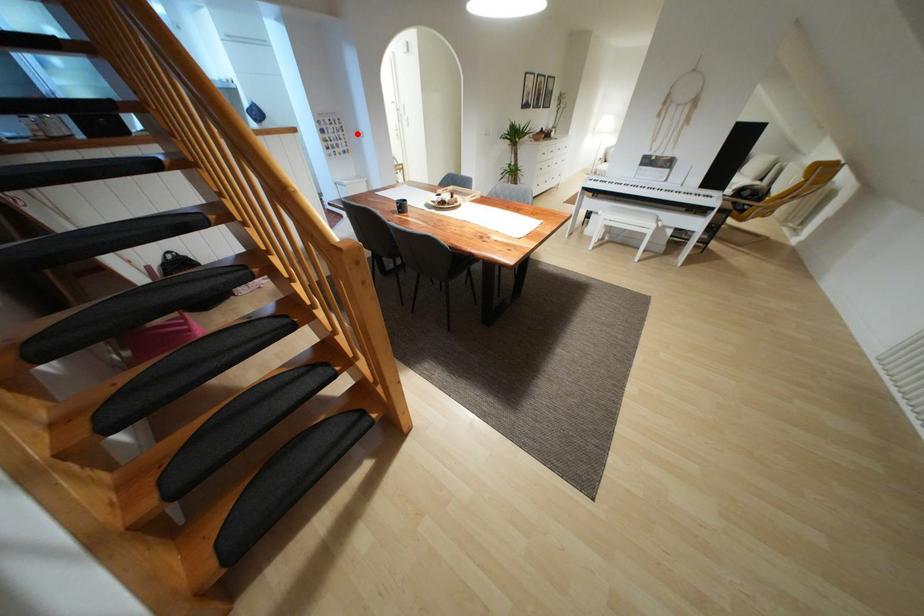
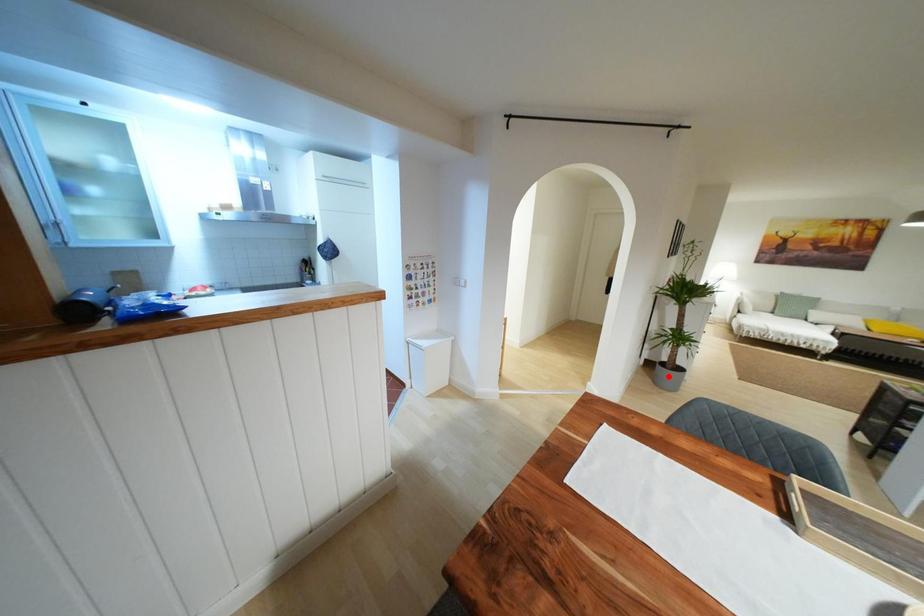
I am providing you with two images of the same scene from different viewpoints. A red point is marked on the first image and another point is marked on the second image. Is the red point in image1 aligned with the point shown in image2?

No